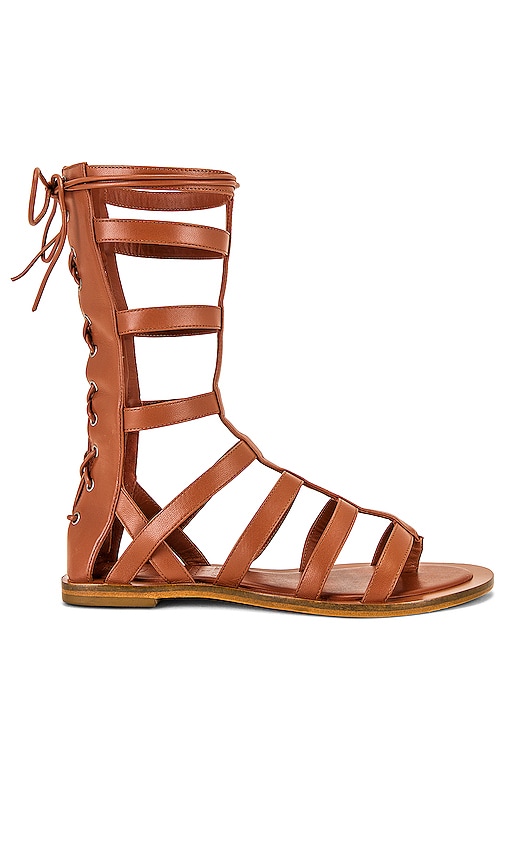
The height and width of the screenshot is (864, 505). I want to click on foot pad, so click(x=270, y=577), click(x=339, y=577), click(x=200, y=567), click(x=424, y=580), click(x=147, y=573).